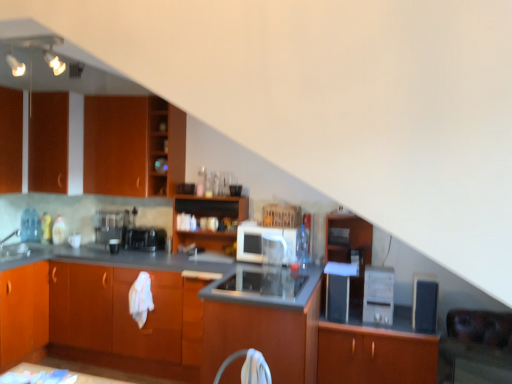
This screenshot has height=384, width=512. What are the coordinates of `matte wood cabinets at upper left, placed as the second cabinetry when sorted from left to right` in the screenshot? It's located at click(x=132, y=146).

The image size is (512, 384). Describe the element at coordinates (264, 282) in the screenshot. I see `sleek stainless steel stove at center, which is counted as the fourth appliance, starting from the right` at that location.

What do you see at coordinates (26, 372) in the screenshot?
I see `smooth white table at lower left` at bounding box center [26, 372].

The image size is (512, 384). Describe the element at coordinates (378, 295) in the screenshot. I see `wooden cabinet at center, which appears as the 2th appliance when viewed from the right` at that location.

This screenshot has height=384, width=512. Describe the element at coordinates (165, 147) in the screenshot. I see `wooden shelves at upper left` at that location.

What do you see at coordinates (208, 216) in the screenshot? I see `wooden shelves at center, the 6th cabinetry when ordered from left to right` at bounding box center [208, 216].

You are a GUI agent. You are given a task and a screenshot of the screen. Output one action in this format:
    pyautogui.click(x=<x>, y=<y>)
    Task: Click on the matte wood cabinets at upper left, which is the seventh cabinetry from right to left
    
    Given the screenshot: What is the action you would take?
    pyautogui.click(x=132, y=146)

Does white glossy sink at left turn towards matte wood cabinet at upper left, arranged as the 3th cabinetry when viewed from the left?

No, white glossy sink at left does not turn towards matte wood cabinet at upper left, arranged as the 3th cabinetry when viewed from the left.

How much distance is there between white glossy sink at left and matte wood cabinet at upper left, arranged as the 3th cabinetry when viewed from the left?

white glossy sink at left is 1.09 meters from matte wood cabinet at upper left, arranged as the 3th cabinetry when viewed from the left.

Is white glossy sink at left behind matte wood cabinet at upper left, acting as the sixth cabinetry starting from the right?

No, white glossy sink at left is closer to the viewer.

Does white glossy sink at left appear on the left side of matte wood cabinet at upper left, arranged as the 3th cabinetry when viewed from the left?

Indeed, white glossy sink at left is positioned on the left side of matte wood cabinet at upper left, arranged as the 3th cabinetry when viewed from the left.

Does white glossy microwave at center, the third appliance viewed from the right, have a greater width compared to smooth white table at lower left?

Correct, the width of white glossy microwave at center, the third appliance viewed from the right, exceeds that of smooth white table at lower left.

Is white glossy microwave at center, the third appliance viewed from the right, next to smooth white table at lower left and touching it?

white glossy microwave at center, the third appliance viewed from the right, is not next to smooth white table at lower left, and they're not touching.

Considering the relative positions of white glossy microwave at center, the 3th appliance viewed from the left, and smooth white table at lower left in the image provided, is white glossy microwave at center, the 3th appliance viewed from the left, to the left or to the right of smooth white table at lower left?

white glossy microwave at center, the 3th appliance viewed from the left, is positioned on smooth white table at lower left's right side.

Is white glossy microwave at center, the third appliance viewed from the right, bigger or smaller than smooth white table at lower left?

white glossy microwave at center, the third appliance viewed from the right, is bigger than smooth white table at lower left.

Which of these two, matte wood cabinets at center, the fifth cabinetry when ordered from left to right, or matte wood cabinet at left, the 8th cabinetry viewed from the right, is thinner?

matte wood cabinet at left, the 8th cabinetry viewed from the right.

From a real-world perspective, does matte wood cabinets at center, which is the fourth cabinetry in right-to-left order, sit lower than matte wood cabinet at left, the 8th cabinetry viewed from the right?

Yes, from a real-world perspective, matte wood cabinets at center, which is the fourth cabinetry in right-to-left order, is beneath matte wood cabinet at left, the 8th cabinetry viewed from the right.

Is the depth of matte wood cabinets at center, which is the fourth cabinetry in right-to-left order, greater than that of matte wood cabinet at left, the 8th cabinetry viewed from the right?

No, it is not.

Is matte wood cabinets at center, which is the fourth cabinetry in right-to-left order, facing towards matte wood cabinet at left, which appears as the first cabinetry when viewed from the left?

No, matte wood cabinets at center, which is the fourth cabinetry in right-to-left order, is not facing towards matte wood cabinet at left, which appears as the first cabinetry when viewed from the left.

Does matte black microwave at center, acting as the fifth appliance starting from the left, have a lesser width compared to white fabric swivel chair at center?

In fact, matte black microwave at center, acting as the fifth appliance starting from the left, might be wider than white fabric swivel chair at center.

Can you confirm if matte black microwave at center, acting as the fifth appliance starting from the left, is bigger than white fabric swivel chair at center?

Yes, matte black microwave at center, acting as the fifth appliance starting from the left, is bigger than white fabric swivel chair at center.

From a real-world perspective, which object rests below the other?

white fabric swivel chair at center, from a real-world perspective.

How much distance is there between matte black microwave at center, which ranks as the 1th appliance in right-to-left order, and white fabric swivel chair at center?

They are 1.36 meters apart.

From the image's perspective, between matte wood cabinet at upper left, acting as the sixth cabinetry starting from the right, and wooden cabinet at center, placed as the 4th appliance when sorted from left to right, which one is located above?

matte wood cabinet at upper left, acting as the sixth cabinetry starting from the right, from the image's perspective.

From the picture: Which point is more forward, (x=146, y=113) or (x=389, y=302)?

Positioned in front is point (x=389, y=302).

Does matte wood cabinet at upper left, acting as the sixth cabinetry starting from the right, appear on the left side of wooden cabinet at center, placed as the 4th appliance when sorted from left to right?

Correct, you'll find matte wood cabinet at upper left, acting as the sixth cabinetry starting from the right, to the left of wooden cabinet at center, placed as the 4th appliance when sorted from left to right.

Based on the photo, is the surface of matte wood cabinet at upper left, acting as the sixth cabinetry starting from the right, in direct contact with wooden cabinet at center, placed as the 4th appliance when sorted from left to right?

matte wood cabinet at upper left, acting as the sixth cabinetry starting from the right, is not next to wooden cabinet at center, placed as the 4th appliance when sorted from left to right, and they're not touching.

Do you think wooden cabinet at center, placed as the 4th appliance when sorted from left to right, is within wooden file cabinet at center, or outside of it?

The correct answer is: outside.

Which object is closer to the camera taking this photo, wooden cabinet at center, which appears as the 2th appliance when viewed from the right, or wooden file cabinet at center?

Positioned in front is wooden cabinet at center, which appears as the 2th appliance when viewed from the right.

From the image's perspective, is wooden cabinet at center, placed as the 4th appliance when sorted from left to right, on wooden file cabinet at center?

No, from the image's perspective, wooden cabinet at center, placed as the 4th appliance when sorted from left to right, is not on top of wooden file cabinet at center.

Is wooden cabinet at center, placed as the 4th appliance when sorted from left to right, not close to wooden file cabinet at center?

No, wooden cabinet at center, placed as the 4th appliance when sorted from left to right, is not far from wooden file cabinet at center.

Considering the relative sizes of wooden cabinet at lower right, arranged as the 1th cabinetry when viewed from the right, and white glossy sink at left in the image provided, is wooden cabinet at lower right, arranged as the 1th cabinetry when viewed from the right, thinner than white glossy sink at left?

In fact, wooden cabinet at lower right, arranged as the 1th cabinetry when viewed from the right, might be wider than white glossy sink at left.

I want to click on sink on the left side of wooden cabinet at lower right, arranged as the 1th cabinetry when viewed from the right, so click(x=13, y=249).

Can you tell me how much wooden cabinet at lower right, arranged as the 1th cabinetry when viewed from the right, and white glossy sink at left differ in facing direction?

91.2 degrees separate the facing orientations of wooden cabinet at lower right, arranged as the 1th cabinetry when viewed from the right, and white glossy sink at left.

From the image's perspective, is wooden cabinet at lower right, arranged as the 1th cabinetry when viewed from the right, located above or below white glossy sink at left?

Based on their image positions, wooden cabinet at lower right, arranged as the 1th cabinetry when viewed from the right, is located beneath white glossy sink at left.

From the image's perspective, which cabinetry is the 3rd one above the white glossy sink at left? Please provide its 2D coordinates.

[(115, 145)]

I want to click on table top on the left of white glossy microwave at center, the 3th appliance viewed from the left, so coord(26,372).

From the image, which object appears to be nearer to satin black coffee machine at center, matte wood cabinets at center, the fifth cabinetry when ordered from left to right, or wooden cabinet at lower right, the 8th cabinetry in the left-to-right sequence?

matte wood cabinets at center, the fifth cabinetry when ordered from left to right, lies closer to satin black coffee machine at center than the other object.

Looking at the image, which one is located closer to matte wood cabinet at left, which appears as the first cabinetry when viewed from the left, black plastic coffee maker at center, marked as the fifth appliance in a right-to-left arrangement, or wooden cabinet at center, which appears as the 2th appliance when viewed from the right?

black plastic coffee maker at center, marked as the fifth appliance in a right-to-left arrangement, is closer to matte wood cabinet at left, which appears as the first cabinetry when viewed from the left.

Looking at the image, which one is located further to black plastic coffee maker at center, which appears as the 1th appliance when viewed from the left, wooden shelves at upper left or wooden cabinet at center, the 7th cabinetry positioned from the left?

Among the two, wooden cabinet at center, the 7th cabinetry positioned from the left, is located further to black plastic coffee maker at center, which appears as the 1th appliance when viewed from the left.

From the picture: Looking at the image, which one is located further to satin black coffee machine at center, wooden cabinet at center, the 7th cabinetry positioned from the left, or sleek stainless steel stove at center, which is counted as the fourth appliance, starting from the right?

wooden cabinet at center, the 7th cabinetry positioned from the left, is positioned further to the anchor satin black coffee machine at center.

Estimate the real-world distances between objects in this image. Which object is closer to white glossy sink at left, matte wood cabinet at left, the 8th cabinetry viewed from the right, or smooth white table at lower left?

matte wood cabinet at left, the 8th cabinetry viewed from the right.

Looking at the image, which one is located further to matte wood cabinets at upper left, which is the seventh cabinetry from right to left, satin black coffee machine at center or smooth white table at lower left?

Based on the image, smooth white table at lower left appears to be further to matte wood cabinets at upper left, which is the seventh cabinetry from right to left.

Estimate the real-world distances between objects in this image. Which object is closer to wooden file cabinet at center, matte wood cabinets at center, which is the fourth cabinetry in right-to-left order, or satin black coffee machine at center?

matte wood cabinets at center, which is the fourth cabinetry in right-to-left order, lies closer to wooden file cabinet at center than the other object.

Considering their positions, is wooden cabinet at lower right, arranged as the 1th cabinetry when viewed from the right, positioned closer to white fabric swivel chair at center than matte wood cabinet at upper left, arranged as the 3th cabinetry when viewed from the left?

wooden cabinet at lower right, arranged as the 1th cabinetry when viewed from the right, lies closer to white fabric swivel chair at center than the other object.

Find the location of a particular element. file cabinet between matte wood cabinets at upper left, placed as the second cabinetry when sorted from left to right, and wooden cabinet at lower right, arranged as the 1th cabinetry when viewed from the right, in the horizontal direction is located at coordinates (349, 248).

You are a GUI agent. You are given a task and a screenshot of the screen. Output one action in this format:
    pyautogui.click(x=<x>, y=<y>)
    Task: Click on the swivel chair positioned between smooth white table at lower left and matte wood cabinets at center, the fifth cabinetry when ordered from left to right, from near to far
    Image resolution: width=512 pixels, height=384 pixels.
    Given the screenshot: What is the action you would take?
    pyautogui.click(x=248, y=367)

In order to click on file cabinet located between matte wood cabinet at upper left, arranged as the 3th cabinetry when viewed from the left, and wooden cabinet at center, placed as the 4th appliance when sorted from left to right, in the left-right direction in this screenshot , I will do `click(349, 248)`.

You are a GUI agent. You are given a task and a screenshot of the screen. Output one action in this format:
    pyautogui.click(x=<x>, y=<y>)
    Task: Click on the table top located between satin black coffee machine at center and wooden cabinet at lower right, the 8th cabinetry in the left-to-right sequence, in the left-right direction
    
    Given the screenshot: What is the action you would take?
    pyautogui.click(x=26, y=372)